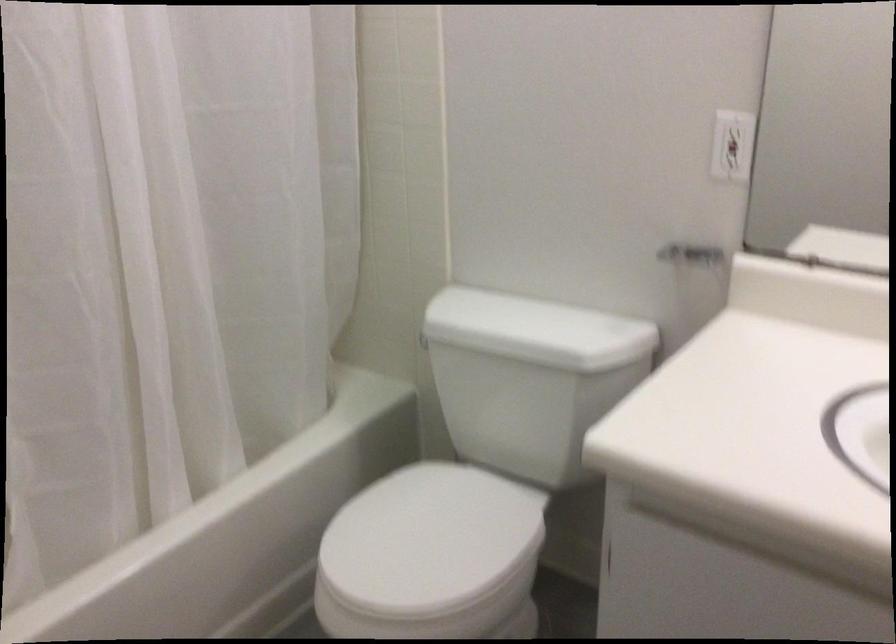
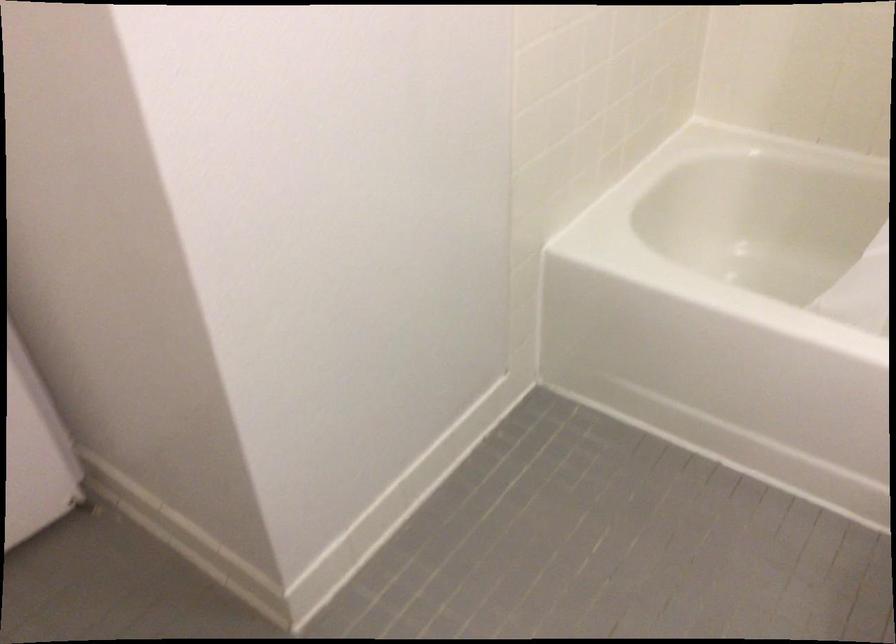
Based on the continuous images, in which direction is the camera rotating?

The camera rotated toward left-down.